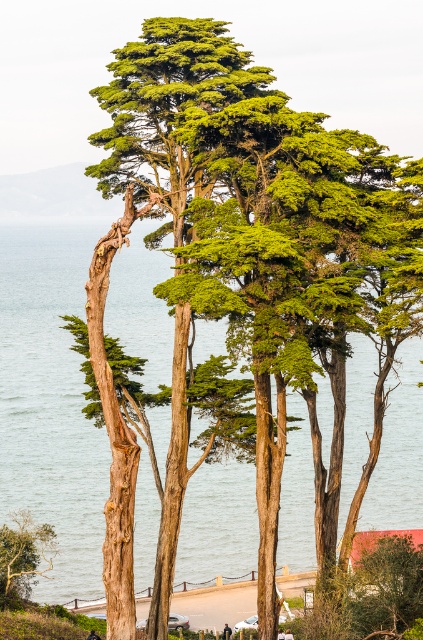
Question: Does green water at center have a lesser width compared to green leafy tree at lower left?

Choices:
 (A) no
 (B) yes

Answer: (A)

Question: Is green water at center wider than green leafy tree at lower left?

Choices:
 (A) yes
 (B) no

Answer: (A)

Question: Among these points, which one is nearest to the camera?

Choices:
 (A) (10, 576)
 (B) (8, 253)

Answer: (A)

Question: Is green water at center positioned at the back of green leafy tree at lower left?

Choices:
 (A) no
 (B) yes

Answer: (B)